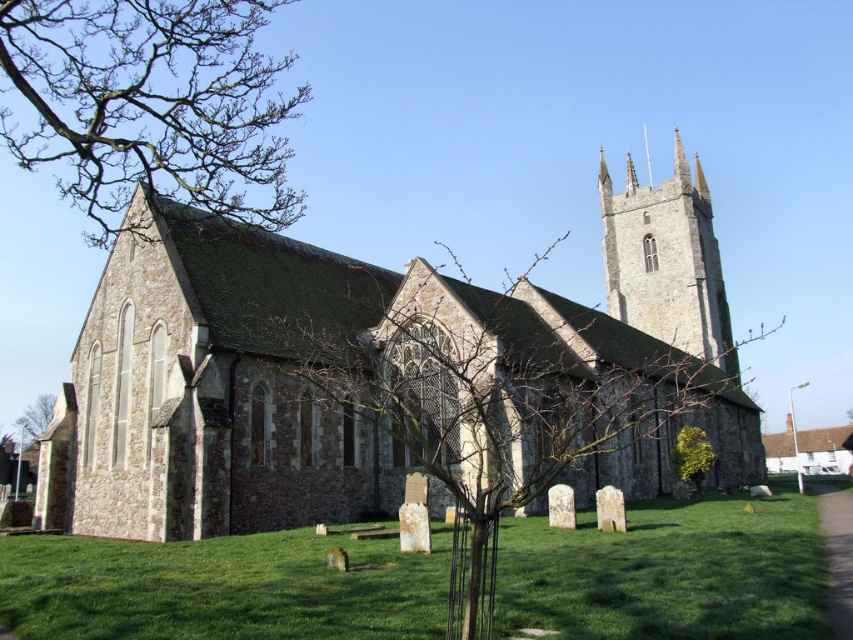
Question: Among these objects, which one is farthest from the camera?

Choices:
 (A) green leafy tree at lower left
 (B) stone steeple at upper right

Answer: (A)

Question: In this image, where is stone church at center located relative to green leafy tree at lower right?

Choices:
 (A) below
 (B) above

Answer: (B)

Question: Does bare branches at upper left come behind green leafy tree at lower left?

Choices:
 (A) no
 (B) yes

Answer: (A)

Question: Which point is farther to the camera?

Choices:
 (A) green grass at lower right
 (B) bare branches at upper left
 (C) stone steeple at upper right

Answer: (C)

Question: Which of the following is the farthest from the observer?

Choices:
 (A) (631, 595)
 (B) (45, 394)

Answer: (B)

Question: Can you confirm if green grass at lower right is positioned to the left of bare branches at upper left?

Choices:
 (A) no
 (B) yes

Answer: (A)